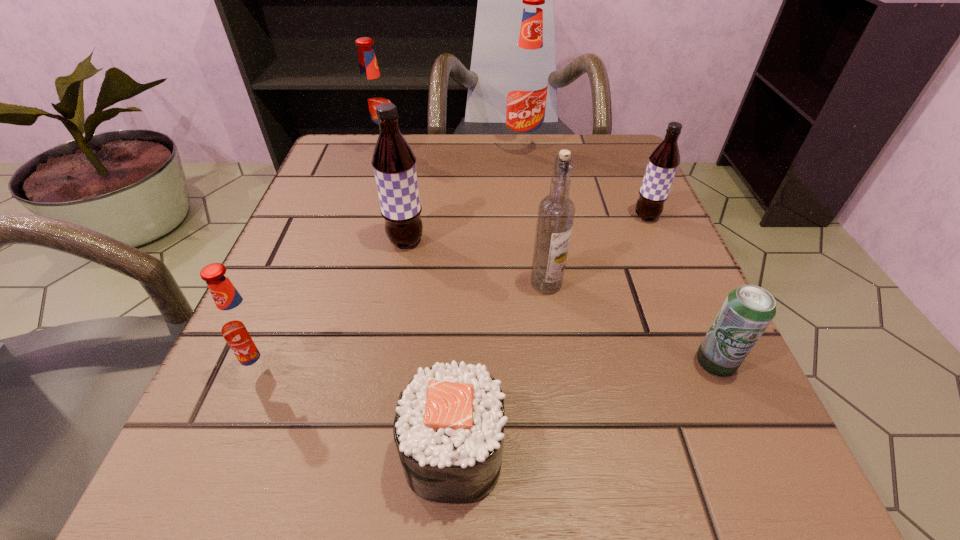
Locate an element on the screen. This screenshot has height=540, width=960. vacant space at the far left corner of the desktop is located at coordinates (332, 168).

I want to click on vacant area at the near left corner of the desktop, so click(x=239, y=489).

Locate an element on the screen. This screenshot has height=540, width=960. free spot at the far right corner of the desktop is located at coordinates (614, 175).

At what (x,y) coordinates should I click in order to perform the action: click on vacant space at the near right corner. Please return your answer as a coordinate pair (x, y). This screenshot has width=960, height=540. Looking at the image, I should click on (745, 514).

The image size is (960, 540). Identify the location of vacant area between the fifth object from right to left and the biggest red root beer. (489, 301).

Where is `free space that is in between the third farthest object and the nearest root beer`? free space that is in between the third farthest object and the nearest root beer is located at coordinates (457, 292).

The width and height of the screenshot is (960, 540). I want to click on free space that is in between the smallest red root beer and the biggest red root beer, so click(x=396, y=258).

You are a GUI agent. You are given a task and a screenshot of the screen. Output one action in this format:
    pyautogui.click(x=<x>, y=<y>)
    Task: Click on the vacant space in between the tallest object and the third farthest object
    
    Given the screenshot: What is the action you would take?
    pyautogui.click(x=585, y=183)

In order to click on unoccupied position between the nearest red root beer and the third root beer from left to right in this screenshot , I will do `click(337, 304)`.

You are a GUI agent. You are given a task and a screenshot of the screen. Output one action in this format:
    pyautogui.click(x=<x>, y=<y>)
    Task: Click on the vacant area that lies between the second smallest red root beer and the smallest red root beer
    This screenshot has height=540, width=960.
    Given the screenshot: What is the action you would take?
    pyautogui.click(x=325, y=262)